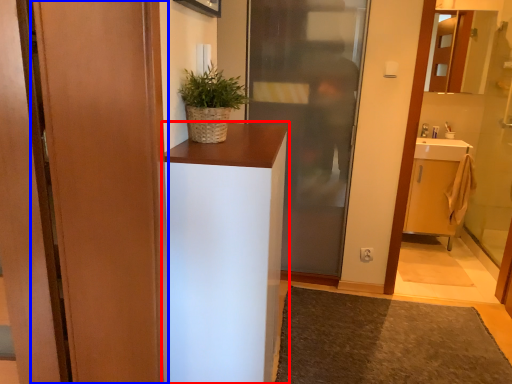
Question: Which object is closer to the camera taking this photo, cabinetry (highlighted by a red box) or door (highlighted by a blue box)?

Choices:
 (A) cabinetry
 (B) door

Answer: (B)